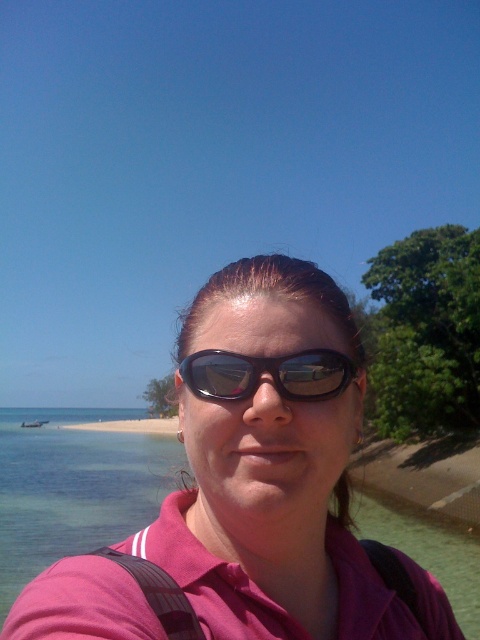
Question: Is clear water at beach front positioned before sunglasses at center?

Choices:
 (A) yes
 (B) no

Answer: (B)

Question: Observing the image, what is the correct spatial positioning of clear water at beach front in reference to sunglasses at center?

Choices:
 (A) above
 (B) below

Answer: (B)

Question: Among these points, which one is nearest to the camera?

Choices:
 (A) (475, 566)
 (B) (226, 390)

Answer: (B)

Question: Is clear water at beach front to the left of sunglasses at center from the viewer's perspective?

Choices:
 (A) yes
 (B) no

Answer: (A)

Question: Which object appears closest to the camera in this image?

Choices:
 (A) clear water at beach front
 (B) sunglasses at center

Answer: (B)

Question: Which point is farther to the camera?

Choices:
 (A) sunglasses at center
 (B) clear water at beach front

Answer: (B)